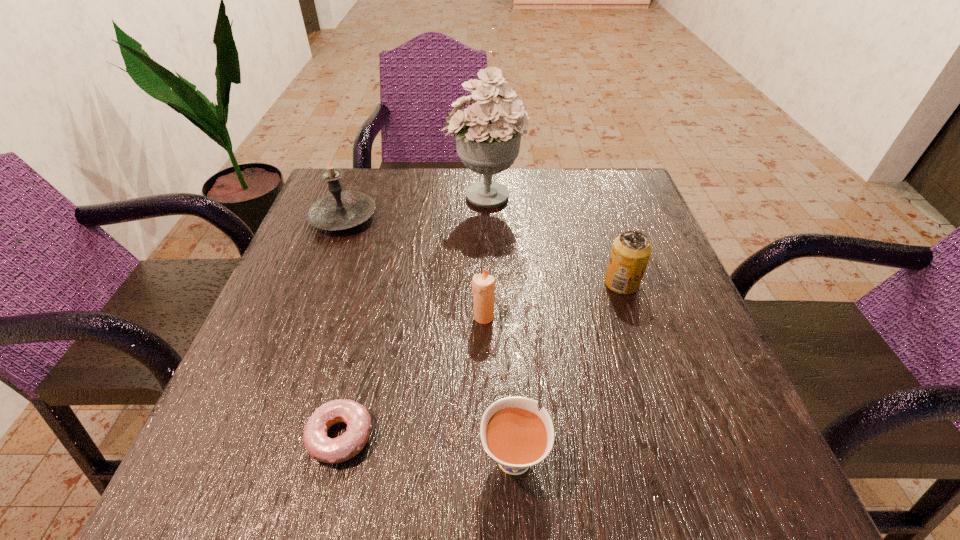
At what (x,y) coordinates should I click in order to perform the action: click on bouquet. Please return your answer as a coordinate pair (x, y). Looking at the image, I should click on (488, 135).

Locate an element on the screen. the taller candle is located at coordinates (338, 210).

At what (x,y) coordinates should I click in order to perform the action: click on the left candle. Please return your answer as a coordinate pair (x, y). Looking at the image, I should click on (338, 210).

Where is `the nearer candle`? The image size is (960, 540). the nearer candle is located at coordinates (483, 285).

Locate an element on the screen. the right candle is located at coordinates (483, 285).

At what (x,y) coordinates should I click in order to perform the action: click on the fourth nearest object. Please return your answer as a coordinate pair (x, y). This screenshot has height=540, width=960. Looking at the image, I should click on (631, 251).

This screenshot has width=960, height=540. In order to click on the rightmost object in this screenshot , I will do `click(631, 251)`.

What are the coordinates of `the fifth tallest object` in the screenshot? It's located at (513, 433).

The width and height of the screenshot is (960, 540). What are the coordinates of `the shortest object` in the screenshot? It's located at (320, 447).

I want to click on free location located on the front of the tallest object, so click(486, 302).